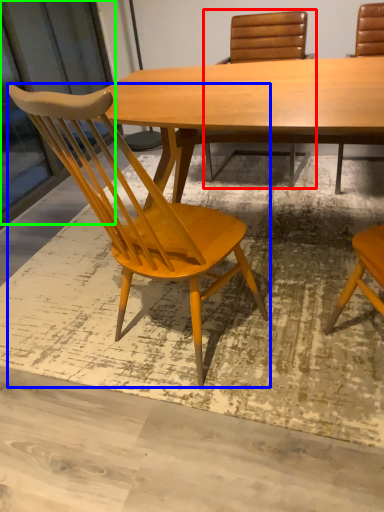
Question: Which object is the farthest from chair (highlighted by a red box)? Choose among these: chair (highlighted by a blue box) or screen door (highlighted by a green box).

Choices:
 (A) chair
 (B) screen door

Answer: (A)